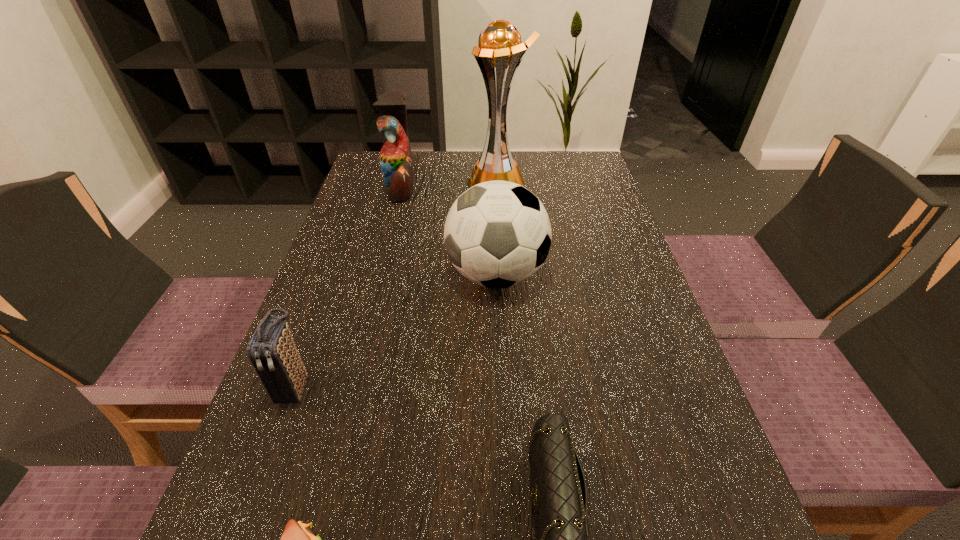
At what (x,y) coordinates should I click in order to perform the action: click on free space that satisfies the following two spatial constraints: 1. at the face of the parrot; 2. with the zip open on the taller clutch bag. Please return your answer as a coordinate pair (x, y). This screenshot has width=960, height=540. Looking at the image, I should click on (349, 387).